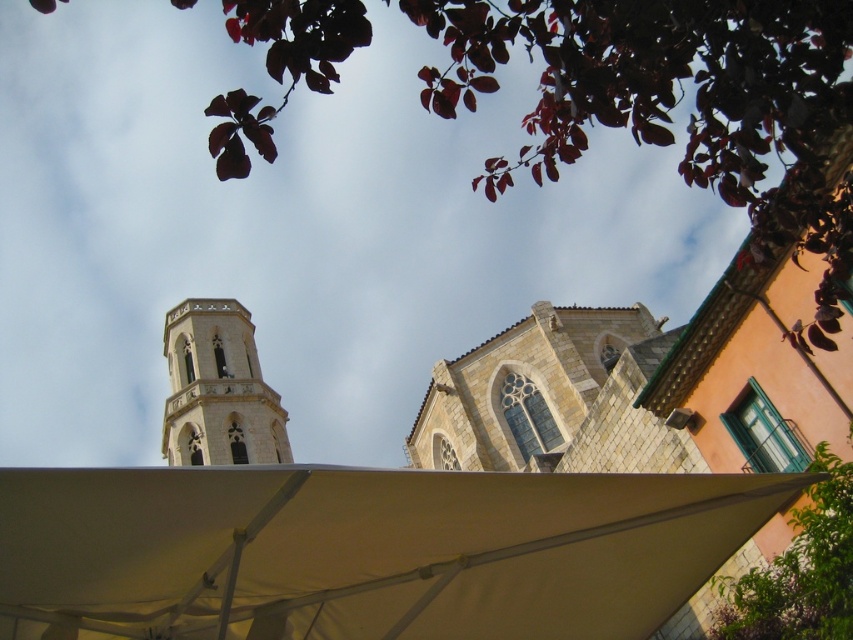
Question: Which of the following is the farthest from the observer?

Choices:
 (A) stone tower at center
 (B) white fabric canopy at center

Answer: (A)

Question: Can you confirm if white fabric canopy at center is positioned below stone tower at center?

Choices:
 (A) yes
 (B) no

Answer: (B)

Question: Can you confirm if white fabric canopy at center is smaller than stone tower at center?

Choices:
 (A) no
 (B) yes

Answer: (B)

Question: Does white fabric canopy at center have a greater width compared to stone tower at center?

Choices:
 (A) yes
 (B) no

Answer: (B)

Question: Which point appears closest to the camera in this image?

Choices:
 (A) coord(624,570)
 (B) coord(279,410)

Answer: (A)